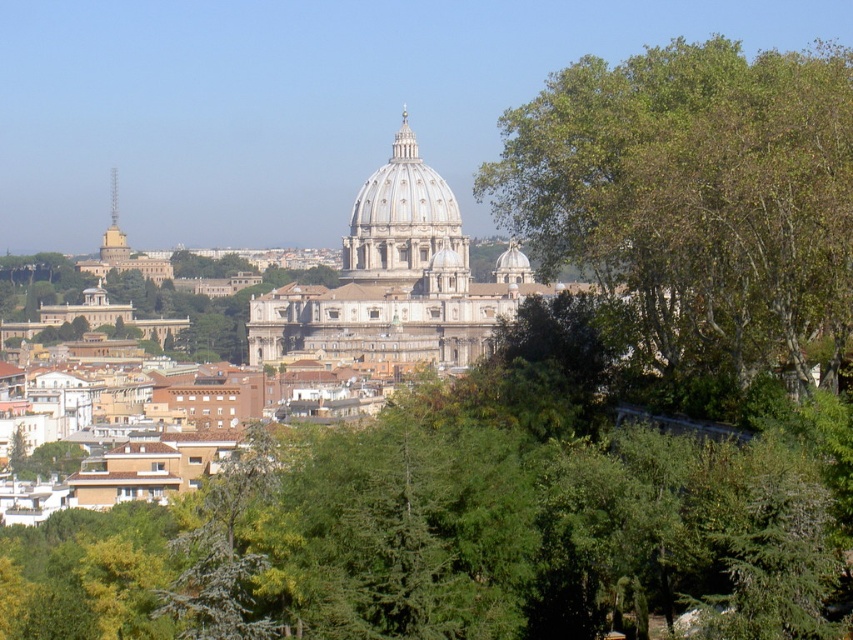
Question: Where is green leafy tree at upper right located in relation to white marble dome at center in the image?

Choices:
 (A) below
 (B) above

Answer: (B)

Question: Which point is farther to the camera?

Choices:
 (A) green leafy tree at center
 (B) white marble dome at center
 (C) green leafy tree at upper right

Answer: (B)

Question: Which object is closer to the camera taking this photo?

Choices:
 (A) green leafy tree at center
 (B) green leafy tree at upper right
 (C) white marble dome at center

Answer: (A)

Question: Does green leafy tree at upper right appear over white marble dome at center?

Choices:
 (A) yes
 (B) no

Answer: (A)

Question: Which point is farther from the camera taking this photo?

Choices:
 (A) (334, 474)
 (B) (463, 244)
 (C) (660, 232)

Answer: (B)

Question: Observing the image, what is the correct spatial positioning of green leafy tree at upper right in reference to white marble dome at center?

Choices:
 (A) above
 (B) below

Answer: (A)